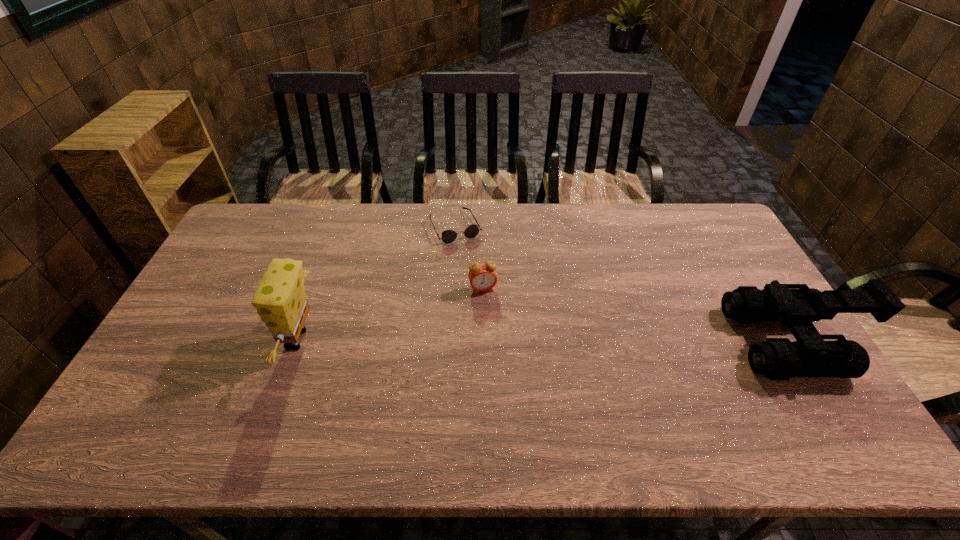
What are the coordinates of `object that is at the far edge` in the screenshot? It's located at pyautogui.click(x=448, y=236).

You are a GUI agent. You are given a task and a screenshot of the screen. Output one action in this format:
    pyautogui.click(x=<x>, y=<y>)
    Task: Click on the sponge that is positioned at the near edge
    The image size is (960, 540).
    Given the screenshot: What is the action you would take?
    pyautogui.click(x=280, y=300)

Locate an element on the screen. binoculars situated at the near edge is located at coordinates (796, 306).

The image size is (960, 540). I want to click on object that is at the right edge, so click(x=796, y=306).

The width and height of the screenshot is (960, 540). I want to click on object situated at the near right corner, so click(796, 306).

Identify the location of free region at the far edge. (600, 231).

In the image, there is a desktop. At what (x,y) coordinates should I click in order to perform the action: click on vacant space at the near edge. Please return your answer as a coordinate pair (x, y). Looking at the image, I should click on (453, 395).

Locate an element on the screen. The width and height of the screenshot is (960, 540). vacant region at the left edge of the desktop is located at coordinates (197, 366).

At what (x,y) coordinates should I click in order to perform the action: click on free point at the right edge. Please return your answer as a coordinate pair (x, y). Image resolution: width=960 pixels, height=540 pixels. Looking at the image, I should click on (767, 325).

In the image, there is a desktop. Where is `vacant space at the near left corner`? Image resolution: width=960 pixels, height=540 pixels. vacant space at the near left corner is located at coordinates (165, 392).